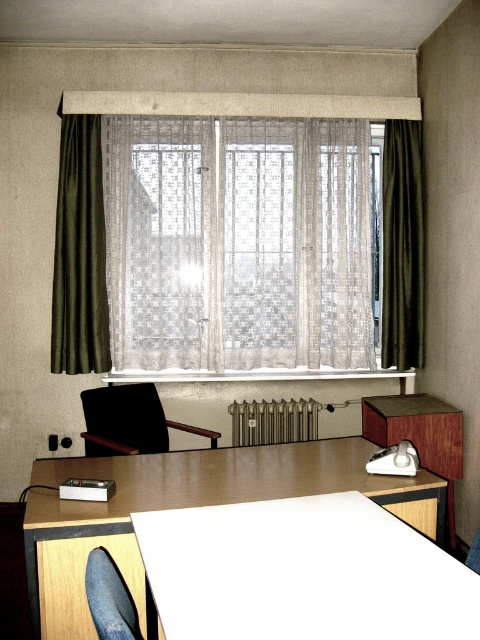
Question: Which is nearer to the silver metallic radiator at center?

Choices:
 (A) black wood armchair at left
 (B) dark olive green fabric curtain at left

Answer: (A)

Question: Does dark green fabric curtain at right have a larger size compared to silver metallic radiator at center?

Choices:
 (A) no
 (B) yes

Answer: (B)

Question: Does white lace curtain at center appear under light brown wooden table at center?

Choices:
 (A) no
 (B) yes

Answer: (A)

Question: From the image, what is the correct spatial relationship of silver metallic radiator at center in relation to matte black swivel chair at lower left?

Choices:
 (A) above
 (B) below

Answer: (B)

Question: Which point is farther from the camera taking this photo?

Choices:
 (A) (78, 305)
 (B) (129, 604)
 (C) (84, 403)

Answer: (A)

Question: Which point appears closest to the camera in this image?

Choices:
 (A) (106, 321)
 (B) (130, 637)
 (C) (86, 440)
 (D) (229, 180)

Answer: (B)